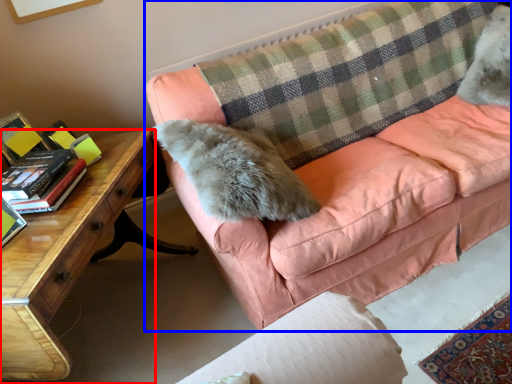
Question: Which point is closer to the camera, desk (highlighted by a red box) or studio couch (highlighted by a blue box)?

Choices:
 (A) desk
 (B) studio couch

Answer: (A)